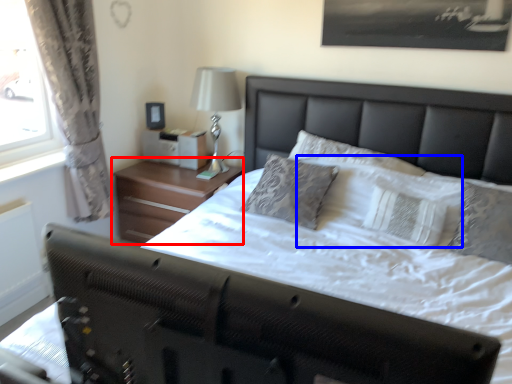
Question: Among these objects, which one is nearest to the camera, nightstand (highlighted by a red box) or pillow (highlighted by a blue box)?

Choices:
 (A) nightstand
 (B) pillow

Answer: (B)